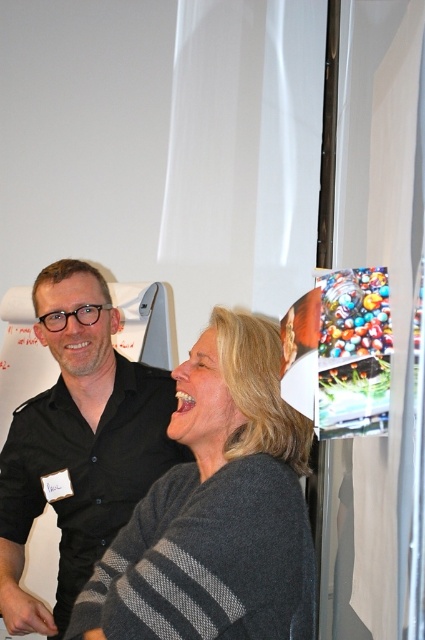
Is gray striped sweater at center shorter than black matte shirt at upper left?

Yes.

Who is more forward, (x=175, y=476) or (x=71, y=388)?

Point (x=175, y=476) is in front.

Is point (212, 480) farther from viewer compared to point (78, 364)?

No, it is in front of (78, 364).

Image resolution: width=425 pixels, height=640 pixels. I want to click on gray striped sweater at center, so click(x=215, y=509).